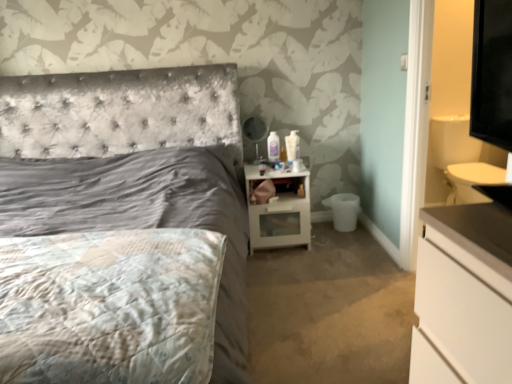
Question: Considering the relative sizes of white glossy lotion at upper center and satin gray bed at center in the image provided, is white glossy lotion at upper center thinner than satin gray bed at center?

Choices:
 (A) no
 (B) yes

Answer: (B)

Question: Considering the relative sizes of white glossy lotion at upper center and satin gray bed at center in the image provided, is white glossy lotion at upper center wider than satin gray bed at center?

Choices:
 (A) yes
 (B) no

Answer: (B)

Question: Is white glossy lotion at upper center located outside satin gray bed at center?

Choices:
 (A) yes
 (B) no

Answer: (A)

Question: Can you see white glossy lotion at upper center touching satin gray bed at center?

Choices:
 (A) no
 (B) yes

Answer: (A)

Question: Is white glossy lotion at upper center looking in the opposite direction of satin gray bed at center?

Choices:
 (A) no
 (B) yes

Answer: (A)

Question: From a real-world perspective, is white glossy lotion at upper center physically located above or below white glossy nightstand at center?

Choices:
 (A) above
 (B) below

Answer: (A)

Question: Is white glossy lotion at upper center to the left or to the right of white glossy nightstand at center in the image?

Choices:
 (A) left
 (B) right

Answer: (B)

Question: From the image's perspective, is white glossy lotion at upper center above or below white glossy nightstand at center?

Choices:
 (A) below
 (B) above

Answer: (B)

Question: Considering the positions of white glossy lotion at upper center and white glossy nightstand at center in the image, is white glossy lotion at upper center wider or thinner than white glossy nightstand at center?

Choices:
 (A) thin
 (B) wide

Answer: (A)

Question: From the image's perspective, is satin gray bed at center located above or below fluffy white mattress at lower left?

Choices:
 (A) below
 (B) above

Answer: (B)

Question: From a real-world perspective, is satin gray bed at center positioned above or below fluffy white mattress at lower left?

Choices:
 (A) above
 (B) below

Answer: (A)

Question: Considering the positions of point (231, 221) and point (212, 316), is point (231, 221) closer or farther from the camera than point (212, 316)?

Choices:
 (A) closer
 (B) farther

Answer: (B)

Question: In terms of size, does satin gray bed at center appear bigger or smaller than fluffy white mattress at lower left?

Choices:
 (A) small
 (B) big

Answer: (B)

Question: Is satin gray bed at center inside or outside of white glossy lotion at upper center?

Choices:
 (A) inside
 (B) outside

Answer: (B)

Question: Is satin gray bed at center bigger or smaller than white glossy lotion at upper center?

Choices:
 (A) big
 (B) small

Answer: (A)